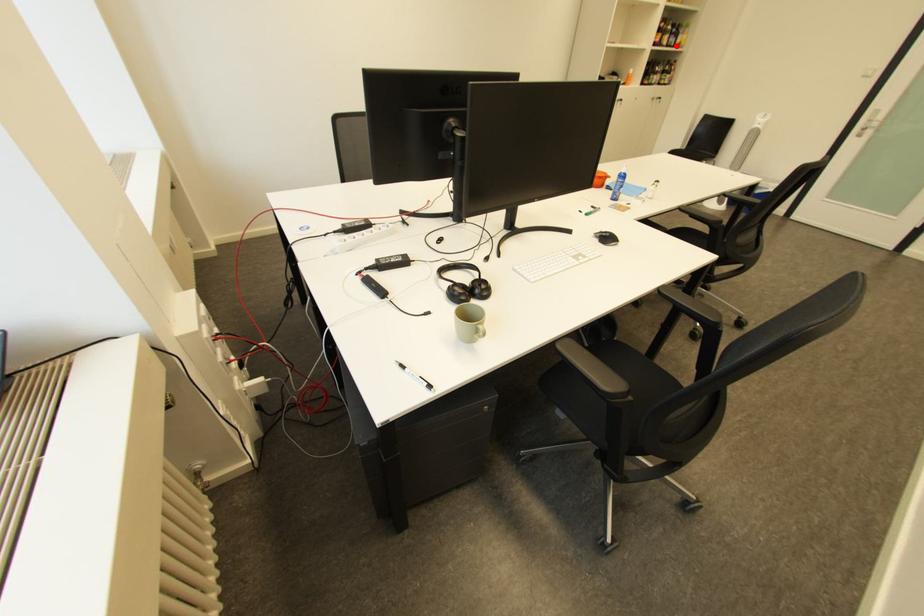
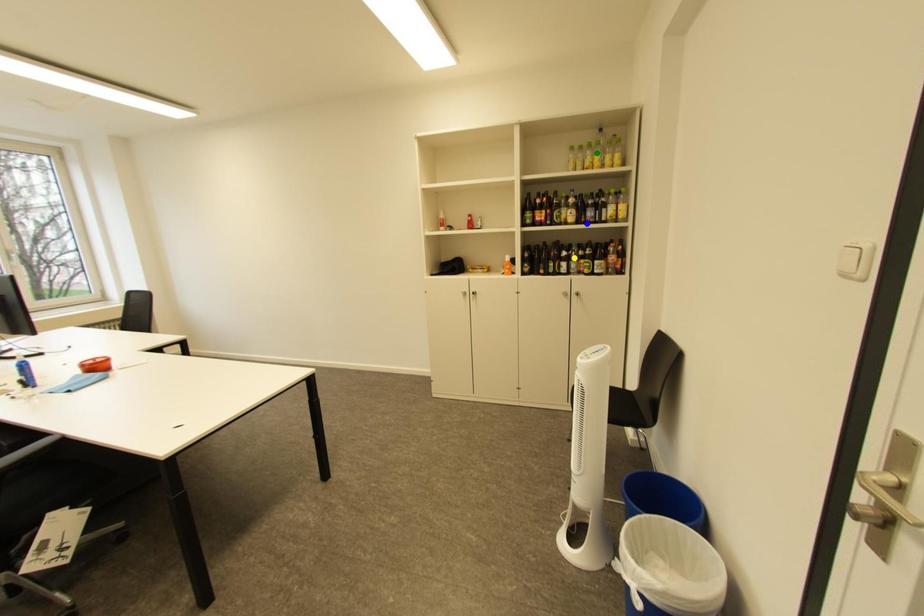
Question: I am providing you with two images of the same scene from different viewpoints. A red point is marked on the first image. You are given multiple points on the second image. Which point in image 2 represents the same 3d spot as the red point in image 1?

Choices:
 (A) blue point
 (B) green point
 (C) yellow point

Answer: (A)